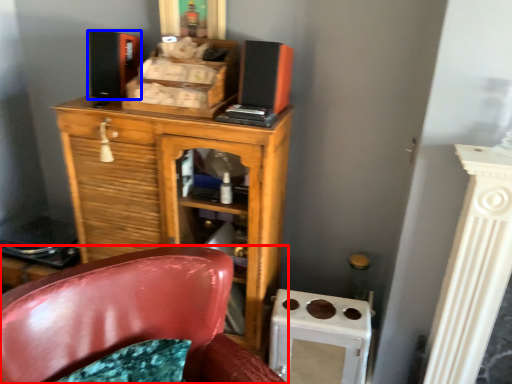
Question: Which object appears closest to the camera in this image, chair (highlighted by a red box) or speaker (highlighted by a blue box)?

Choices:
 (A) chair
 (B) speaker

Answer: (A)